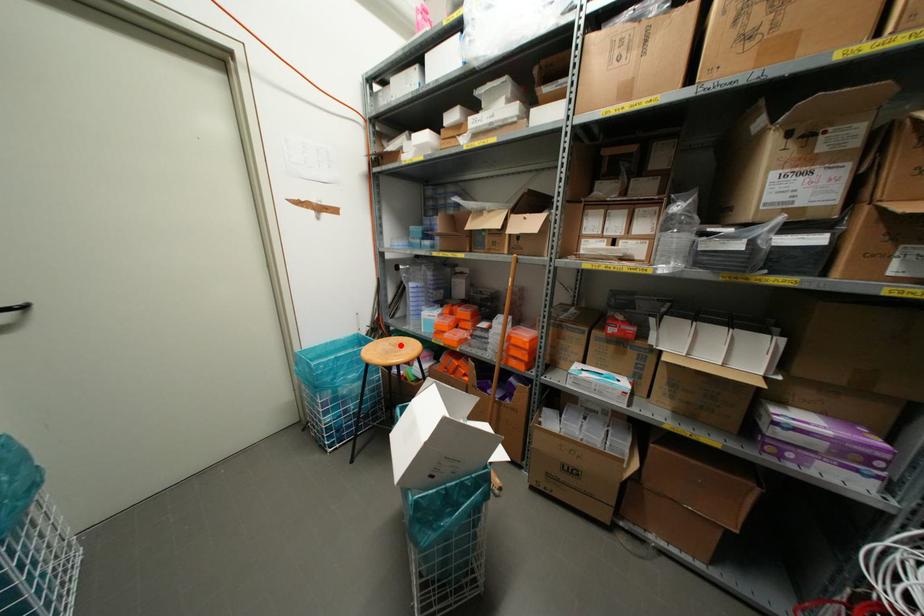
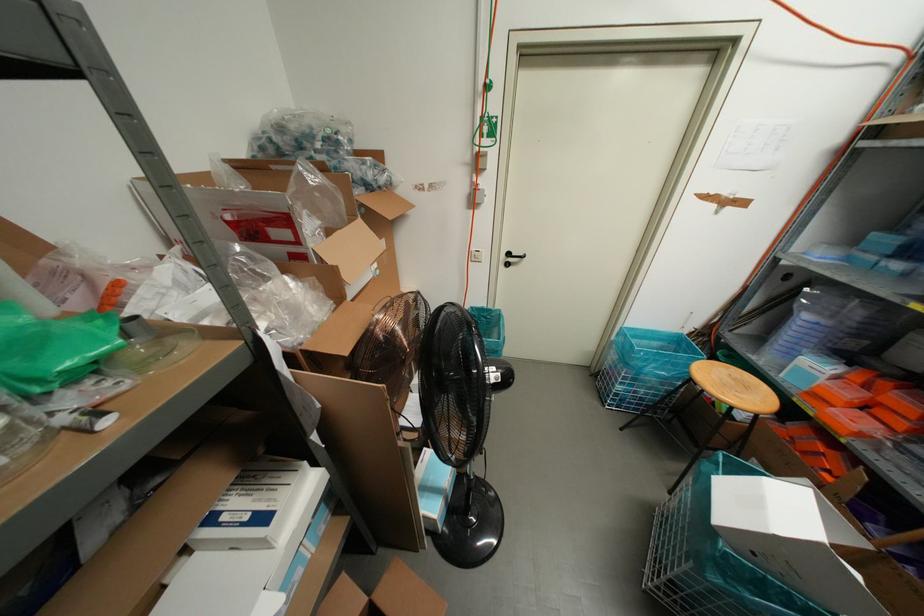
Find the pixel in the second image that matches the highlighted location in the first image.

(745, 387)